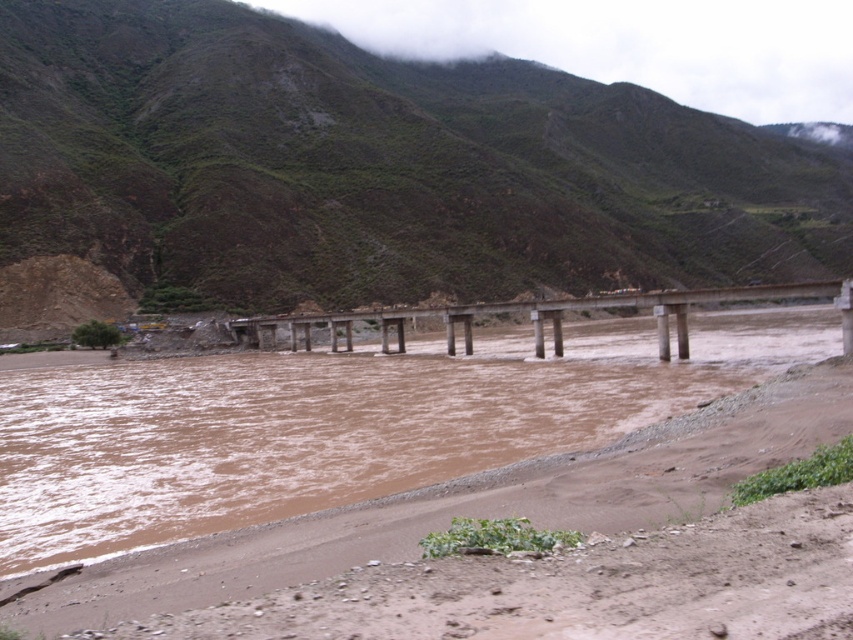
From the picture: You are a hiker trying to cross the river using the bridge. You need to know which area is wider between the green grassy hillside at upper center and the brown muddy water at center to decide where to set up your equipment. Which one is wider?

The green grassy hillside at upper center is wider than the brown muddy water at center, so you should set up your equipment there.

You are a hiker who wants to take a photo of the green grassy hillside at upper center. Where exactly should you position the camera to capture it in the frame?

The green grassy hillside at upper center is located at point 0.272 on the horizontal axis and 0.430 on the vertical axis, so you should position the camera at that coordinate to capture it in the frame.

You are a hiker planning to cross the river using the concrete bridge at center. You notice a green grassy hillside at upper center in the distance. Which direction should you head to reach the bridge first?

You should head towards the concrete bridge at center because it is located below the green grassy hillside at upper center, so the bridge is closer to your current position.